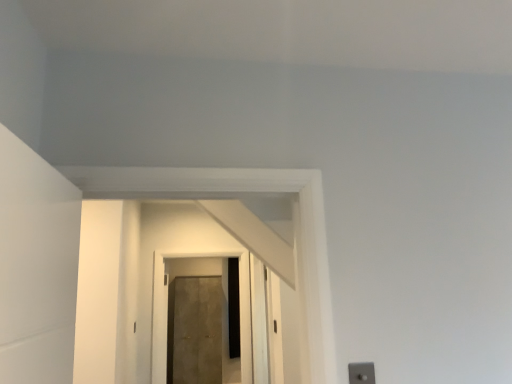
Question: From a real-world perspective, is matte concrete door at center, placed as the second door when sorted from front to back, physically below silver metallic switch at lower right?

Choices:
 (A) yes
 (B) no

Answer: (A)

Question: Considering the relative sizes of matte concrete door at center, the 1th door from the back, and silver metallic switch at lower right in the image provided, is matte concrete door at center, the 1th door from the back, thinner than silver metallic switch at lower right?

Choices:
 (A) no
 (B) yes

Answer: (A)

Question: Is matte concrete door at center, placed as the second door when sorted from front to back, outside of silver metallic switch at lower right?

Choices:
 (A) yes
 (B) no

Answer: (A)

Question: From the image's perspective, would you say matte concrete door at center, placed as the second door when sorted from front to back, is shown under silver metallic switch at lower right?

Choices:
 (A) yes
 (B) no

Answer: (A)

Question: Is matte concrete door at center, the 1th door from the back, not close to silver metallic switch at lower right?

Choices:
 (A) yes
 (B) no

Answer: (A)

Question: Is silver metallic switch at lower right completely or partially inside matte concrete door at center, the 1th door from the back?

Choices:
 (A) yes
 (B) no

Answer: (B)

Question: From a real-world perspective, is matte concrete door at center, placed as the second door when sorted from front to back, beneath matte brown door at center, which appears as the first door when viewed from the front?

Choices:
 (A) no
 (B) yes

Answer: (B)

Question: Is matte concrete door at center, placed as the second door when sorted from front to back, positioned before matte brown door at center, marked as the second door in a back-to-front arrangement?

Choices:
 (A) yes
 (B) no

Answer: (B)

Question: Does matte concrete door at center, the 1th door from the back, have a greater width compared to matte brown door at center, marked as the second door in a back-to-front arrangement?

Choices:
 (A) no
 (B) yes

Answer: (B)

Question: From a real-world perspective, does matte concrete door at center, the 1th door from the back, stand above matte brown door at center, which appears as the first door when viewed from the front?

Choices:
 (A) yes
 (B) no

Answer: (B)

Question: Is matte concrete door at center, placed as the second door when sorted from front to back, turned away from matte brown door at center, which appears as the first door when viewed from the front?

Choices:
 (A) yes
 (B) no

Answer: (B)

Question: Is matte concrete door at center, placed as the second door when sorted from front to back, at the left side of matte brown door at center, marked as the second door in a back-to-front arrangement?

Choices:
 (A) no
 (B) yes

Answer: (B)

Question: From the image's perspective, is matte brown door at center, marked as the second door in a back-to-front arrangement, located above silver metallic switch at lower right?

Choices:
 (A) yes
 (B) no

Answer: (B)